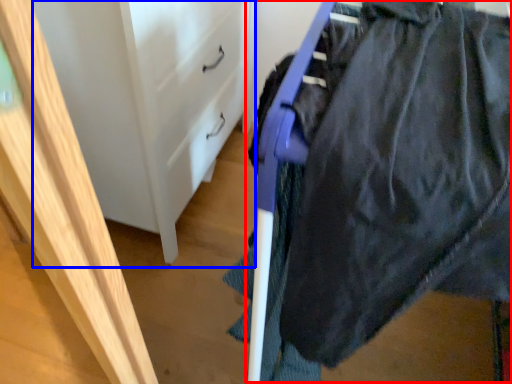
Question: Which of the following is the farthest to the observer, wide (highlighted by a red box) or file cabinet (highlighted by a blue box)?

Choices:
 (A) wide
 (B) file cabinet

Answer: (B)